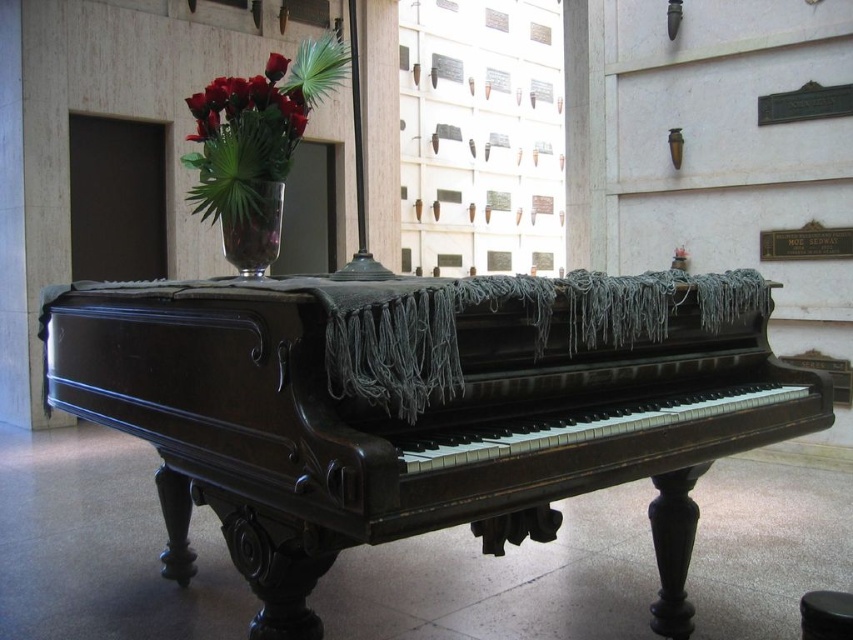
You are standing in the memorial and want to place a small bouquet on the polished dark wood piano at center. Based on its 2D coordinates, can you estimate whether the piano is positioned closer to the front or back wall of the room?

The 2D coordinates of the polished dark wood piano at center are at point (424, 410). Since the x and y values are both greater than 0.5, it is positioned closer to the back wall of the room.